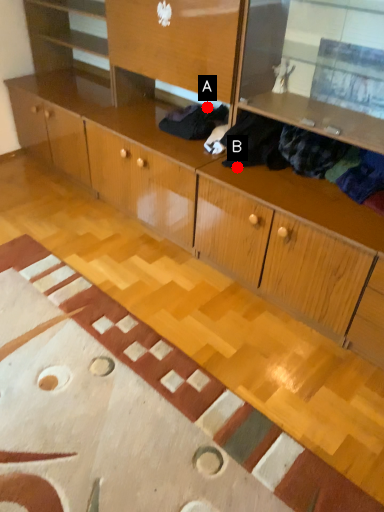
Question: Two points are circled on the image, labeled by A and B beside each circle. Among these points, which one is nearest to the camera?

Choices:
 (A) A is closer
 (B) B is closer

Answer: (B)